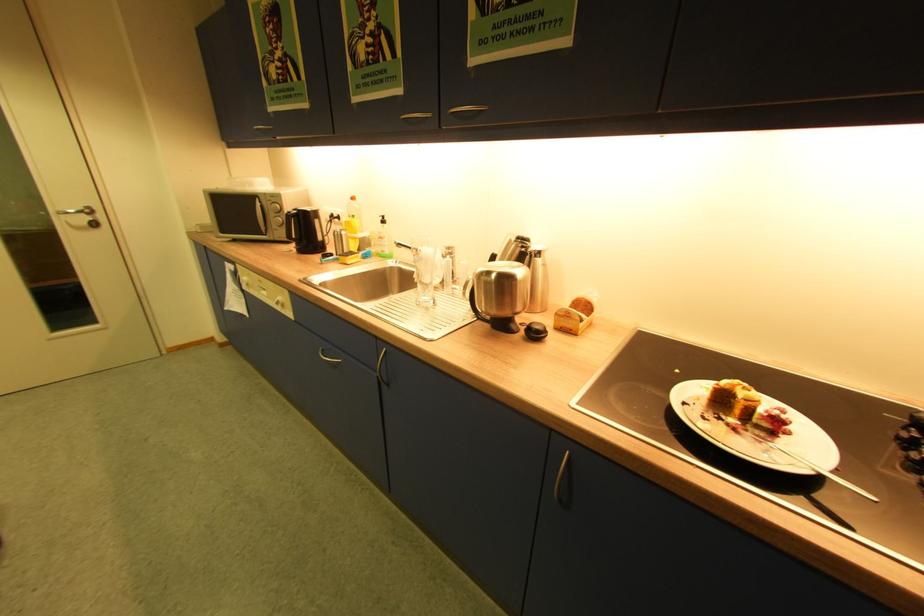
At what (x,y) coordinates should I click in order to perform the action: click on dishwasher handle. Please return your answer as a coordinate pair (x, y). The width and height of the screenshot is (924, 616). Looking at the image, I should click on (293, 225).